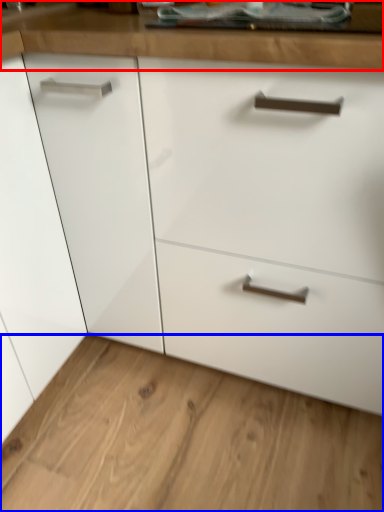
Question: Among these objects, which one is nearest to the camera, counter top (highlighted by a red box) or plain (highlighted by a blue box)?

Choices:
 (A) counter top
 (B) plain

Answer: (A)